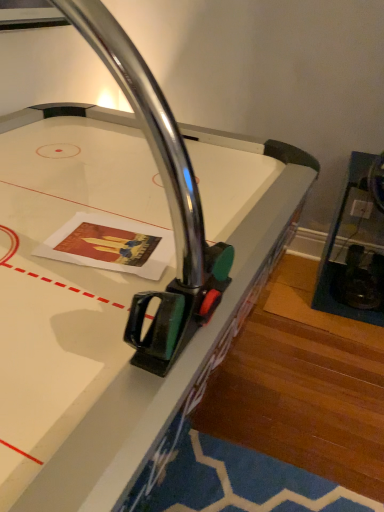
Identify the location of metallic glass shelf at right. (355, 247).

Describe the element at coordinates (355, 247) in the screenshot. The height and width of the screenshot is (512, 384). I see `metallic glass shelf at right` at that location.

What is the approximate width of metallic air hockey table at center?

metallic air hockey table at center is 1.28 meters wide.

Describe the element at coordinates (111, 295) in the screenshot. I see `metallic air hockey table at center` at that location.

The height and width of the screenshot is (512, 384). I want to click on metallic air hockey table at center, so click(111, 295).

You are a GUI agent. You are given a task and a screenshot of the screen. Output one action in this format:
    pyautogui.click(x=<x>, y=<y>)
    Task: Click on the metallic glass shelf at right
    The image size is (384, 512).
    Given the screenshot: What is the action you would take?
    pyautogui.click(x=355, y=247)

Is metallic glass shelf at right to the left of metallic air hockey table at center from the viewer's perspective?

No.

In the scene shown: Relative to metallic air hockey table at center, is metallic glass shelf at right in front or behind?

Visually, metallic glass shelf at right is located behind metallic air hockey table at center.

Which is closer to the camera, (373, 304) or (233, 207)?

Point (373, 304) is farther from the camera than point (233, 207).

From the image's perspective, which one is positioned lower, metallic glass shelf at right or metallic air hockey table at center?

metallic air hockey table at center is shown below in the image.

From a real-world perspective, which object stands above the other?

In real-world perspective, metallic air hockey table at center is above.

Which of these two, metallic glass shelf at right or metallic air hockey table at center, is thinner?

metallic glass shelf at right is thinner.

In terms of height, does metallic glass shelf at right look taller or shorter compared to metallic air hockey table at center?

Clearly, metallic glass shelf at right is shorter compared to metallic air hockey table at center.

From the picture: Is metallic glass shelf at right bigger or smaller than metallic air hockey table at center?

Clearly, metallic glass shelf at right is smaller in size than metallic air hockey table at center.

Is metallic air hockey table at center located within metallic glass shelf at right?

Definitely not — metallic air hockey table at center is not inside metallic glass shelf at right.

Are metallic glass shelf at right and metallic air hockey table at center beside each other?

No, metallic glass shelf at right is not next to metallic air hockey table at center.

Is metallic glass shelf at right oriented towards metallic air hockey table at center?

No, metallic glass shelf at right is not turned towards metallic air hockey table at center.

Can you tell me how much metallic glass shelf at right and metallic air hockey table at center differ in facing direction?

metallic glass shelf at right and metallic air hockey table at center are facing 84.2 degrees away from each other.

You are a GUI agent. You are given a task and a screenshot of the screen. Output one action in this format:
    pyautogui.click(x=<x>, y=<y>)
    Task: Click on the furniture behind the metallic air hockey table at center
    
    Given the screenshot: What is the action you would take?
    pyautogui.click(x=355, y=247)

Looking at this image, in the image, is metallic air hockey table at center on the left side or the right side of metallic glass shelf at right?

Based on their positions, metallic air hockey table at center is located to the left of metallic glass shelf at right.

In the image, is metallic air hockey table at center positioned in front of or behind metallic glass shelf at right?

Clearly, metallic air hockey table at center is in front of metallic glass shelf at right.

Which is farther from the camera, (96, 287) or (351, 164)?

Positioned behind is point (351, 164).

From the image's perspective, is metallic air hockey table at center located above or below metallic glass shelf at right?

Based on their image positions, metallic air hockey table at center is located beneath metallic glass shelf at right.

From a real-world perspective, does metallic air hockey table at center sit lower than metallic glass shelf at right?

Actually, metallic air hockey table at center is physically above metallic glass shelf at right in the real world.

Which of these two, metallic air hockey table at center or metallic glass shelf at right, is wider?

Wider between the two is metallic air hockey table at center.

Can you confirm if metallic air hockey table at center is taller than metallic glass shelf at right?

Yes, metallic air hockey table at center is taller than metallic glass shelf at right.

Consider the image. In terms of size, does metallic air hockey table at center appear bigger or smaller than metallic glass shelf at right?

Considering their sizes, metallic air hockey table at center takes up more space than metallic glass shelf at right.

Is metallic glass shelf at right a part of metallic air hockey table at center?

No, metallic glass shelf at right is located outside of metallic air hockey table at center.

Would you consider metallic air hockey table at center to be distant from metallic glass shelf at right?

Yes.

Does metallic air hockey table at center turn towards metallic glass shelf at right?

No, metallic air hockey table at center does not turn towards metallic glass shelf at right.

In order to click on table on the left of metallic glass shelf at right in this screenshot , I will do `click(111, 295)`.

Where is `furniture lying on the right of metallic air hockey table at center`? furniture lying on the right of metallic air hockey table at center is located at coordinates (355, 247).

This screenshot has height=512, width=384. In order to click on table lying below the metallic glass shelf at right (from the image's perspective) in this screenshot , I will do `click(111, 295)`.